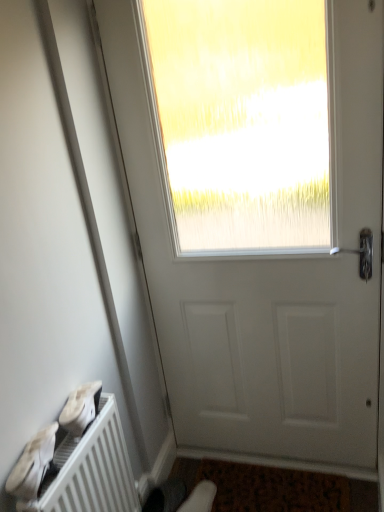
Measure the distance between white suede shoe at lower center, which is the first shoe from right to left, and camera.

They are 1.58 meters apart.

Measure the distance between white matte door at center and camera.

white matte door at center is 3.67 feet away from camera.

Identify the location of brown textured mat at lower center. (273, 488).

This screenshot has height=512, width=384. Describe the element at coordinates (33, 465) in the screenshot. I see `white matte shoe at lower left, the 3th shoe from the back` at that location.

Locate an element on the screen. The width and height of the screenshot is (384, 512). white suede shoe at lower center, which appears as the third shoe when viewed from the left is located at coordinates (200, 498).

Which is closer, (88, 406) or (208, 489)?

Point (88, 406) is closer to the camera than point (208, 489).

From a real-world perspective, is white matte shoe at lower left, which is the second shoe from back to front, located higher than white suede shoe at lower center, which ranks as the 1th shoe in back-to-front order?

Yes, from a real-world perspective, white matte shoe at lower left, which is the second shoe from back to front, is above white suede shoe at lower center, which ranks as the 1th shoe in back-to-front order.

Is white matte shoe at lower left, the third shoe when ordered from bottom to top, surrounding white suede shoe at lower center, which is the first shoe from right to left?

No, white suede shoe at lower center, which is the first shoe from right to left, is not inside white matte shoe at lower left, the third shoe when ordered from bottom to top.

Considering the sizes of objects white matte shoe at lower left, marked as the first shoe in a top-to-bottom arrangement, and white suede shoe at lower center, which ranks as the 1th shoe in back-to-front order, in the image provided, who is shorter, white matte shoe at lower left, marked as the first shoe in a top-to-bottom arrangement, or white suede shoe at lower center, which ranks as the 1th shoe in back-to-front order,?

white suede shoe at lower center, which ranks as the 1th shoe in back-to-front order.

Is white matte shoe at lower left, the 2th shoe from the bottom, positioned in front of brown textured mat at lower center?

Yes, white matte shoe at lower left, the 2th shoe from the bottom, is closer to the camera.

Can brown textured mat at lower center be found inside white matte shoe at lower left, the 2th shoe from the bottom?

No, brown textured mat at lower center is not inside white matte shoe at lower left, the 2th shoe from the bottom.

From a real-world perspective, which object stands above the other?

In real-world perspective, white matte shoe at lower left, which is the second shoe in top-to-bottom order, is above.

Between white matte shoe at lower left, the 1th shoe from the left, and white matte shoe at lower left, which ranks as the 2th shoe in front-to-back order, which one is positioned in front?

Positioned in front is white matte shoe at lower left, the 1th shoe from the left.

Can you confirm if white matte shoe at lower left, which is the second shoe in top-to-bottom order, is thinner than white matte shoe at lower left, which is the second shoe from back to front?

Correct, the width of white matte shoe at lower left, which is the second shoe in top-to-bottom order, is less than that of white matte shoe at lower left, which is the second shoe from back to front.

From the image's perspective, is white matte shoe at lower left, the 1th shoe from the left, positioned above or below white matte shoe at lower left, positioned as the second shoe in right-to-left order?

white matte shoe at lower left, the 1th shoe from the left, is situated lower than white matte shoe at lower left, positioned as the second shoe in right-to-left order, in the image.

Which is correct: white suede shoe at lower center, the 3th shoe in the front-to-back sequence, is inside white matte shoe at lower left, the 1th shoe from the left, or outside of it?

white suede shoe at lower center, the 3th shoe in the front-to-back sequence, is located beyond the bounds of white matte shoe at lower left, the 1th shoe from the left.

From a real-world perspective, which shoe is the 2nd one above the white suede shoe at lower center, the third shoe from the top? Please provide its 2D coordinates.

[(33, 465)]

In the image, is white suede shoe at lower center, the 1th shoe from the bottom, positioned in front of or behind white matte shoe at lower left, the 2th shoe from the bottom?

white suede shoe at lower center, the 1th shoe from the bottom, is positioned farther from the viewer than white matte shoe at lower left, the 2th shoe from the bottom.

Between point (206, 501) and point (13, 483), which one is positioned behind?

The point (206, 501) is behind.

Does white suede shoe at lower center, which appears as the third shoe when viewed from the left, have a greater height compared to white matte radiator at lower left?

In fact, white suede shoe at lower center, which appears as the third shoe when viewed from the left, may be shorter than white matte radiator at lower left.

Where is `shoe lying below the white matte radiator at lower left (from the image's perspective)`? The width and height of the screenshot is (384, 512). shoe lying below the white matte radiator at lower left (from the image's perspective) is located at coordinates (200, 498).

Does white suede shoe at lower center, which appears as the third shoe when viewed from the left, have a larger size compared to white matte radiator at lower left?

Actually, white suede shoe at lower center, which appears as the third shoe when viewed from the left, might be smaller than white matte radiator at lower left.

Is white suede shoe at lower center, which is the first shoe from right to left, far away from white matte radiator at lower left?

That's not correct — white suede shoe at lower center, which is the first shoe from right to left, is a little close to white matte radiator at lower left.

Looking at this image, considering the relative sizes of white matte shoe at lower left, the third shoe positioned from the right, and white suede shoe at lower center, which appears as the third shoe when viewed from the left, in the image provided, is white matte shoe at lower left, the third shoe positioned from the right, bigger than white suede shoe at lower center, which appears as the third shoe when viewed from the left,?

Actually, white matte shoe at lower left, the third shoe positioned from the right, might be smaller than white suede shoe at lower center, which appears as the third shoe when viewed from the left.

Considering the sizes of objects white matte shoe at lower left, the 1th shoe from the left, and white suede shoe at lower center, the 1th shoe from the bottom, in the image provided, who is taller, white matte shoe at lower left, the 1th shoe from the left, or white suede shoe at lower center, the 1th shoe from the bottom,?

With more height is white matte shoe at lower left, the 1th shoe from the left.

Could you tell me if white matte radiator at lower left is turned towards brown textured mat at lower center?

No, white matte radiator at lower left is not oriented towards brown textured mat at lower center.

Considering their positions, is white matte radiator at lower left located in front of or behind brown textured mat at lower center?

Visually, white matte radiator at lower left is located in front of brown textured mat at lower center.

From the image's perspective, which object appears higher, white matte radiator at lower left or brown textured mat at lower center?

white matte radiator at lower left appears higher in the image.

Are white matte radiator at lower left and brown textured mat at lower center located far from each other?

Actually, white matte radiator at lower left and brown textured mat at lower center are a little close together.

Where is `shoe behind the white matte shoe at lower left, the third shoe when ordered from bottom to top`? shoe behind the white matte shoe at lower left, the third shoe when ordered from bottom to top is located at coordinates (200, 498).

Where is `doormat beneath the white matte shoe at lower left, the 2th shoe from the bottom (from a real-world perspective)`? This screenshot has height=512, width=384. doormat beneath the white matte shoe at lower left, the 2th shoe from the bottom (from a real-world perspective) is located at coordinates (273, 488).

Based on the photo, looking at the image, which one is located closer to white matte radiator at lower left, brown textured mat at lower center or white matte door at center?

brown textured mat at lower center.

Based on their spatial positions, is brown textured mat at lower center or white matte radiator at lower left closer to white matte shoe at lower left, marked as the first shoe in a top-to-bottom arrangement?

The object closer to white matte shoe at lower left, marked as the first shoe in a top-to-bottom arrangement, is white matte radiator at lower left.

When comparing their distances from white matte radiator at lower left, does brown textured mat at lower center or white matte shoe at lower left, the 2th shoe from the bottom, seem closer?

The object closer to white matte radiator at lower left is white matte shoe at lower left, the 2th shoe from the bottom.

Based on the photo, estimate the real-world distances between objects in this image. Which object is closer to white matte shoe at lower left, positioned as the second shoe in right-to-left order, white matte door at center or brown textured mat at lower center?

white matte door at center lies closer to white matte shoe at lower left, positioned as the second shoe in right-to-left order, than the other object.

Estimate the real-world distances between objects in this image. Which object is further from white matte shoe at lower left, the 2th shoe from the bottom, white matte shoe at lower left, the 2th shoe in the left-to-right sequence, or white matte radiator at lower left?

white matte radiator at lower left lies further to white matte shoe at lower left, the 2th shoe from the bottom, than the other object.

Which object lies nearer to the anchor point white matte door at center, white matte shoe at lower left, positioned as the second shoe in right-to-left order, or brown textured mat at lower center?

The object closer to white matte door at center is brown textured mat at lower center.

Based on their spatial positions, is white matte radiator at lower left or white matte door at center further from white suede shoe at lower center, the third shoe from the top?

white matte door at center is positioned further to the anchor white suede shoe at lower center, the third shoe from the top.

From the image, which object appears to be farther from white matte door at center, white matte shoe at lower left, marked as the first shoe in a top-to-bottom arrangement, or white matte radiator at lower left?

white matte shoe at lower left, marked as the first shoe in a top-to-bottom arrangement, lies further to white matte door at center than the other object.

This screenshot has height=512, width=384. In order to click on doormat between white matte door at center and white suede shoe at lower center, the third shoe from the top, in the vertical direction in this screenshot , I will do `click(273, 488)`.

Locate an element on the screen. This screenshot has height=512, width=384. doormat positioned between white matte radiator at lower left and white suede shoe at lower center, which is the first shoe from right to left, from near to far is located at coordinates (273, 488).

Find the location of `shoe between white matte shoe at lower left, the 2th shoe in the left-to-right sequence, and brown textured mat at lower center from left to right`. shoe between white matte shoe at lower left, the 2th shoe in the left-to-right sequence, and brown textured mat at lower center from left to right is located at coordinates (200, 498).

The height and width of the screenshot is (512, 384). What are the coordinates of `radiator located between white matte shoe at lower left, which is the second shoe in top-to-bottom order, and brown textured mat at lower center in the left-right direction` in the screenshot? It's located at (92, 469).